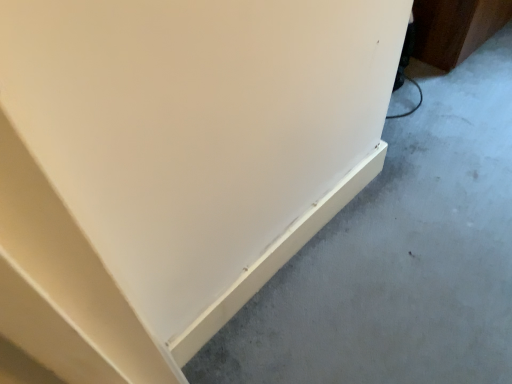
This screenshot has height=384, width=512. What do you see at coordinates (400, 256) in the screenshot?
I see `white smooth baseboard at lower right` at bounding box center [400, 256].

From the picture: What is the approximate width of white smooth baseboard at lower right?

The width of white smooth baseboard at lower right is 7.34 feet.

Locate an element on the screen. white smooth baseboard at lower right is located at coordinates (400, 256).

You are a GUI agent. You are given a task and a screenshot of the screen. Output one action in this format:
    pyautogui.click(x=<x>, y=<y>)
    Task: Click on the white smooth baseboard at lower right
    
    Given the screenshot: What is the action you would take?
    pyautogui.click(x=400, y=256)